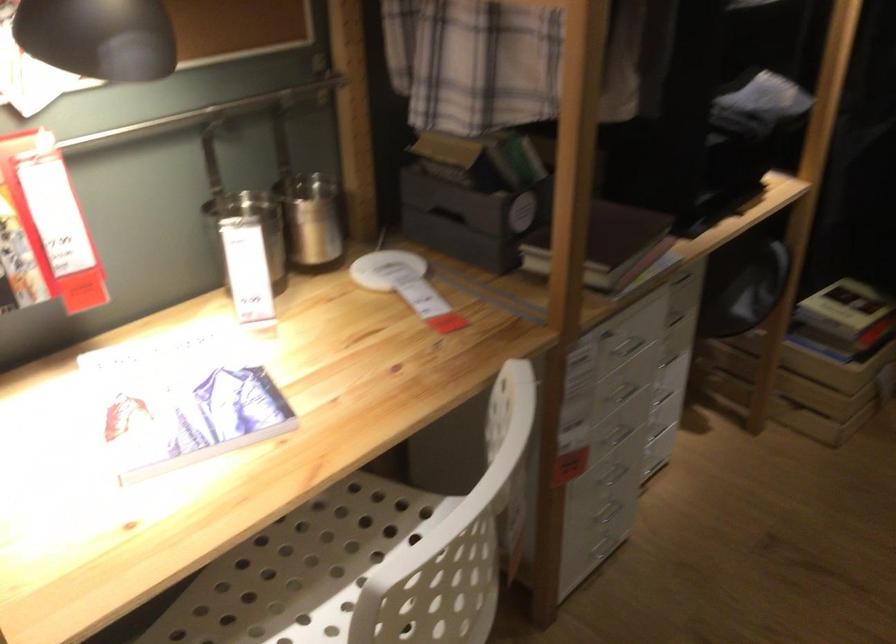
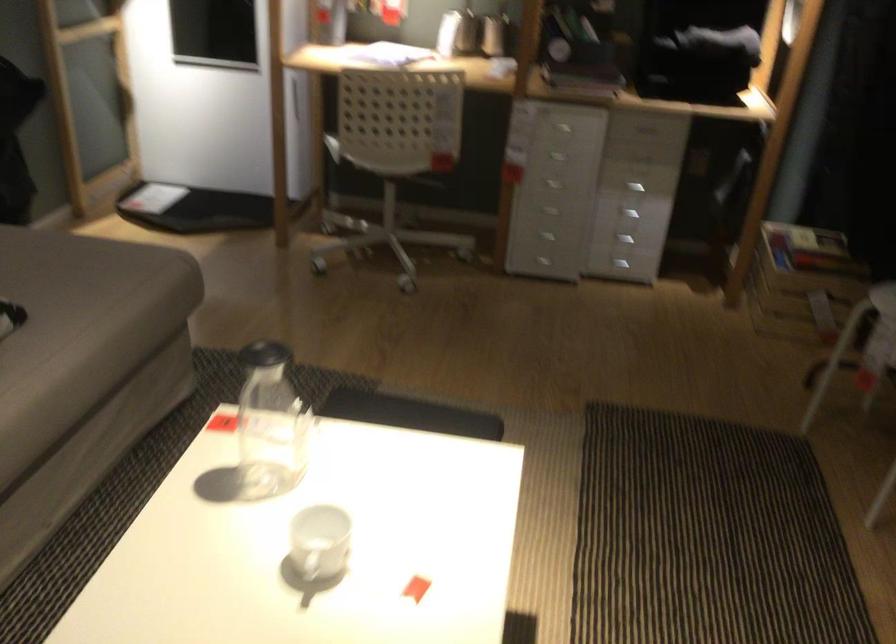
Locate, in the second image, the point that corresponds to (x=691, y=374) in the first image.

(634, 187)